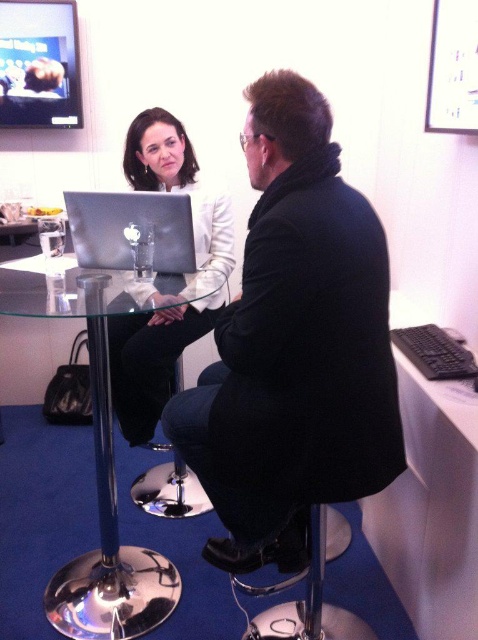
Question: Which of the following is the farthest from the observer?

Choices:
 (A) transparent glass table at center
 (B) dark blue fabric bar stool at center
 (C) white matte jacket at center
 (D) satin silver laptop at center

Answer: (B)

Question: Which point is farther to the camera?

Choices:
 (A) pyautogui.click(x=151, y=355)
 (B) pyautogui.click(x=304, y=563)
 (C) pyautogui.click(x=162, y=472)

Answer: (C)

Question: Can you confirm if transparent glass table at center is smaller than satin silver laptop at center?

Choices:
 (A) yes
 (B) no

Answer: (B)

Question: From the image, what is the correct spatial relationship of black matte coat at center in relation to satin silver laptop at center?

Choices:
 (A) left
 (B) right

Answer: (B)

Question: Is transparent glass table at center below dark blue fabric bar stool at center?

Choices:
 (A) yes
 (B) no

Answer: (B)

Question: Which of these objects is positioned closest to the dark blue fabric bar stool at center?

Choices:
 (A) black matte coat at center
 (B) white matte jacket at center

Answer: (B)